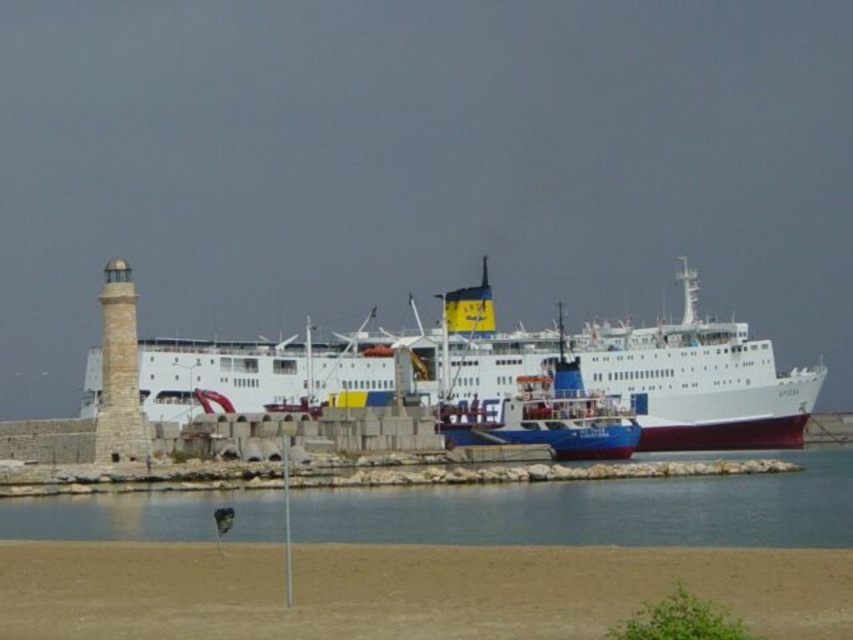
Question: Which point appears closest to the camera in this image?

Choices:
 (A) (624, 448)
 (B) (169, 621)
 (C) (770, 545)

Answer: (B)

Question: Is brown sand at lower center further to camera compared to clear water at lower center?

Choices:
 (A) yes
 (B) no

Answer: (B)

Question: Estimate the real-world distances between objects in this image. Which object is farther from the blue glossy ferry at center?

Choices:
 (A) clear water at lower center
 (B) brown sand at lower center
 (C) white matte ship at center

Answer: (B)

Question: Is white matte ship at center closer to the viewer compared to blue glossy ferry at center?

Choices:
 (A) yes
 (B) no

Answer: (B)

Question: Which of the following is the closest to the observer?

Choices:
 (A) brown sand at lower center
 (B) clear water at lower center
 (C) blue glossy ferry at center

Answer: (A)

Question: Observing the image, what is the correct spatial positioning of brown sand at lower center in reference to blue glossy ferry at center?

Choices:
 (A) left
 (B) right

Answer: (A)